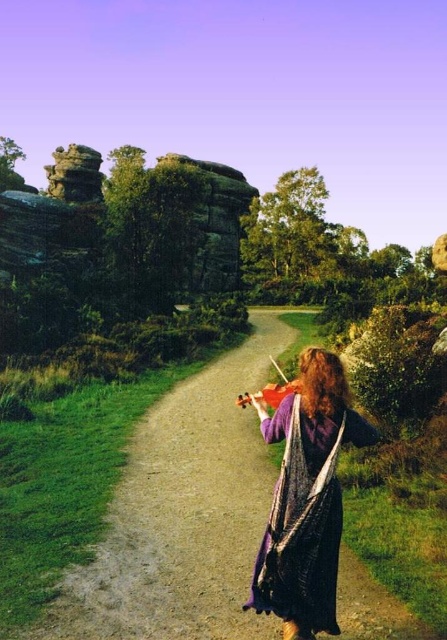
Question: Estimate the real-world distances between objects in this image. Which object is farther from the wooden violin at center?

Choices:
 (A) rustic stone rock formation at upper left
 (B) purple fabric at center

Answer: (A)

Question: Is the position of purple fabric at center less distant than that of rustic stone rock formation at upper left?

Choices:
 (A) no
 (B) yes

Answer: (B)

Question: Which object appears farthest from the camera in this image?

Choices:
 (A) rustic stone rock formation at upper left
 (B) dirt path at center

Answer: (A)

Question: Can you confirm if dirt path at center is positioned above wooden violin at center?

Choices:
 (A) yes
 (B) no

Answer: (B)

Question: From the image, what is the correct spatial relationship of purple fabric at center in relation to rustic stone rock formation at upper left?

Choices:
 (A) above
 (B) below

Answer: (B)

Question: Among these points, which one is nearest to the camera?

Choices:
 (A) (333, 422)
 (B) (79, 157)
 (C) (244, 397)
 (D) (269, 330)

Answer: (A)